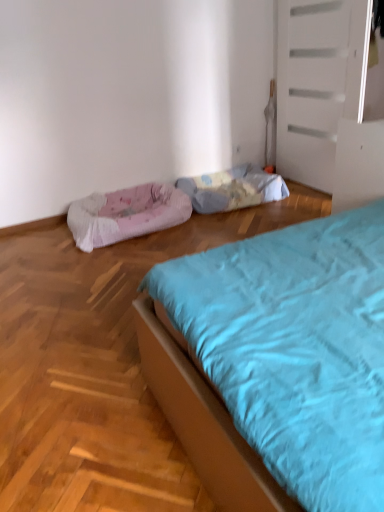
What do you see at coordinates (233, 189) in the screenshot? I see `fluffy blue blanket at center` at bounding box center [233, 189].

Locate an element on the screen. fluffy blue blanket at center is located at coordinates (233, 189).

What is the approximate height of pink textured dog bed at left?

8.39 inches.

What do you see at coordinates (126, 214) in the screenshot?
I see `pink textured dog bed at left` at bounding box center [126, 214].

Identify the location of pink textured dog bed at left. Image resolution: width=384 pixels, height=512 pixels. (126, 214).

This screenshot has width=384, height=512. In order to click on fluffy blue blanket at center in this screenshot , I will do `click(233, 189)`.

Considering the relative positions of fluffy blue blanket at center and pink textured dog bed at left in the image provided, is fluffy blue blanket at center to the right of pink textured dog bed at left from the viewer's perspective?

Correct, you'll find fluffy blue blanket at center to the right of pink textured dog bed at left.

Between fluffy blue blanket at center and pink textured dog bed at left, which one is positioned in front?

pink textured dog bed at left is more forward.

Is point (224, 194) closer or farther from the camera than point (133, 211)?

Clearly, point (224, 194) is more distant from the camera than point (133, 211).

From the image's perspective, is fluffy blue blanket at center above or below pink textured dog bed at left?

fluffy blue blanket at center is situated higher than pink textured dog bed at left in the image.

From a real-world perspective, is fluffy blue blanket at center positioned under pink textured dog bed at left based on gravity?

Yes, from a real-world perspective, fluffy blue blanket at center is beneath pink textured dog bed at left.

Considering the sizes of objects fluffy blue blanket at center and pink textured dog bed at left in the image provided, who is wider, fluffy blue blanket at center or pink textured dog bed at left?

pink textured dog bed at left.

Between fluffy blue blanket at center and pink textured dog bed at left, which one has more height?

fluffy blue blanket at center is taller.

In the scene shown: Is fluffy blue blanket at center smaller than pink textured dog bed at left?

Indeed, fluffy blue blanket at center has a smaller size compared to pink textured dog bed at left.

Which is correct: fluffy blue blanket at center is inside pink textured dog bed at left, or outside of it?

fluffy blue blanket at center is outside pink textured dog bed at left.

Is fluffy blue blanket at center directly adjacent to pink textured dog bed at left?

fluffy blue blanket at center and pink textured dog bed at left are clearly separated.

Is pink textured dog bed at left at the back of fluffy blue blanket at center?

No, pink textured dog bed at left is not at the back of fluffy blue blanket at center.

Can you tell me how much fluffy blue blanket at center and pink textured dog bed at left differ in facing direction?

fluffy blue blanket at center and pink textured dog bed at left are facing 0.000325 degrees away from each other.

You are a GUI agent. You are given a task and a screenshot of the screen. Output one action in this format:
    pyautogui.click(x=<x>, y=<y>)
    Task: Click on the blanket below the pink textured dog bed at left (from a real-world perspective)
    The width and height of the screenshot is (384, 512).
    Given the screenshot: What is the action you would take?
    pyautogui.click(x=233, y=189)

Does pink textured dog bed at left appear on the left side of fluffy blue blanket at center?

Correct, you'll find pink textured dog bed at left to the left of fluffy blue blanket at center.

Is the depth of pink textured dog bed at left greater than that of fluffy blue blanket at center?

No, pink textured dog bed at left is in front of fluffy blue blanket at center.

Which is nearer, (170, 224) or (261, 175)?

Point (170, 224) is positioned closer to the camera compared to point (261, 175).

From the image's perspective, is pink textured dog bed at left above fluffy blue blanket at center?

No, from the image's perspective, pink textured dog bed at left is not above fluffy blue blanket at center.

From a real-world perspective, which is physically above, pink textured dog bed at left or fluffy blue blanket at center?

pink textured dog bed at left, from a real-world perspective.

Can you confirm if pink textured dog bed at left is wider than fluffy blue blanket at center?

Yes, pink textured dog bed at left is wider than fluffy blue blanket at center.

Is pink textured dog bed at left taller than fluffy blue blanket at center?

No, pink textured dog bed at left is not taller than fluffy blue blanket at center.

Looking at the image, does pink textured dog bed at left seem bigger or smaller compared to fluffy blue blanket at center?

pink textured dog bed at left is bigger than fluffy blue blanket at center.

Is pink textured dog bed at left spatially inside fluffy blue blanket at center, or outside of it?

pink textured dog bed at left lies outside fluffy blue blanket at center.

Is pink textured dog bed at left not near fluffy blue blanket at center?

They are positioned close to each other.

Could you tell me if pink textured dog bed at left is turned towards fluffy blue blanket at center?

No, pink textured dog bed at left does not turn towards fluffy blue blanket at center.

Identify the location of dog bed on the left of fluffy blue blanket at center. The image size is (384, 512). (126, 214).

At what (x,y) coordinates should I click in order to perform the action: click on blanket located underneath the pink textured dog bed at left (from a real-world perspective). Please return your answer as a coordinate pair (x, y). The height and width of the screenshot is (512, 384). Looking at the image, I should click on (233, 189).

Identify the location of blanket on the right of pink textured dog bed at left. This screenshot has height=512, width=384. (233, 189).